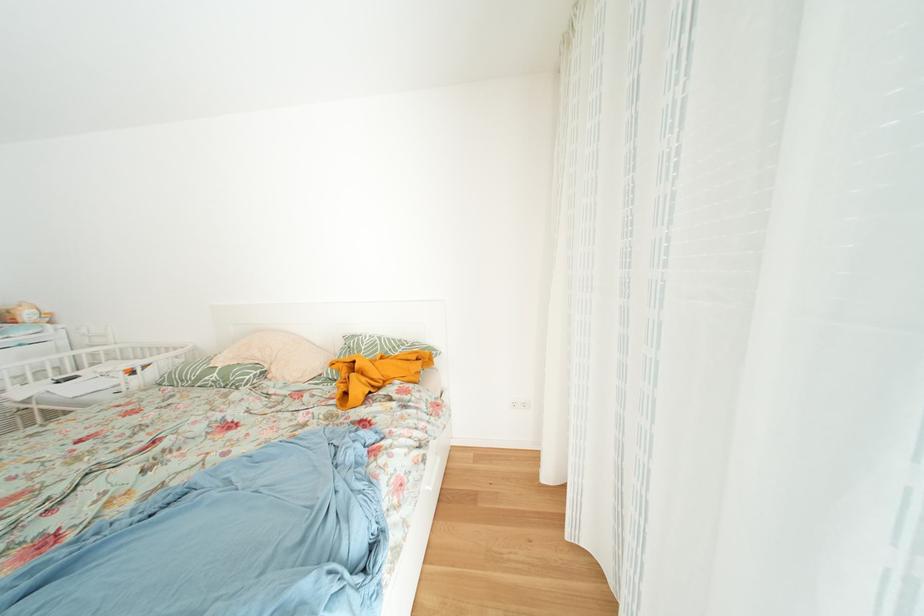
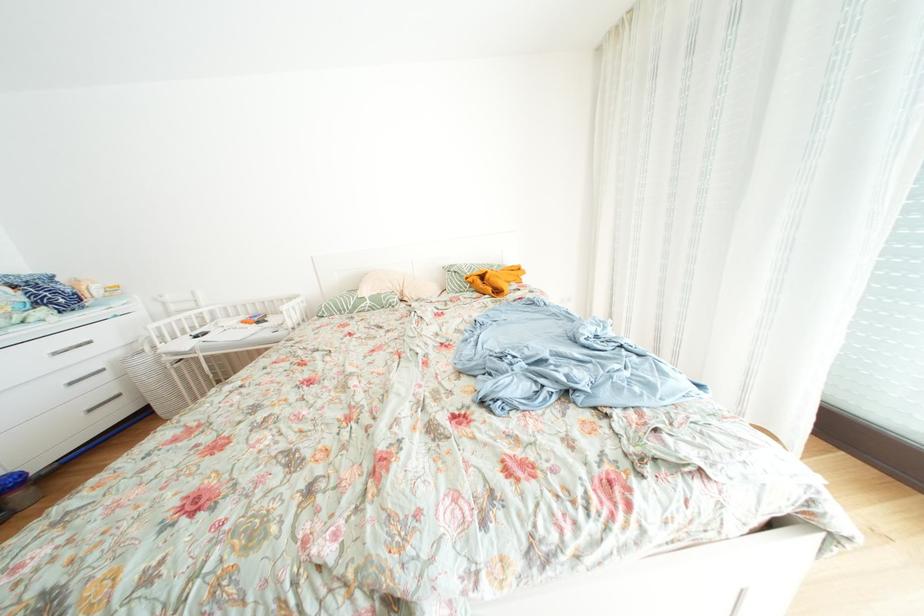
The point at (225, 379) is marked in the first image. Where is the corresponding point in the second image?

(378, 307)